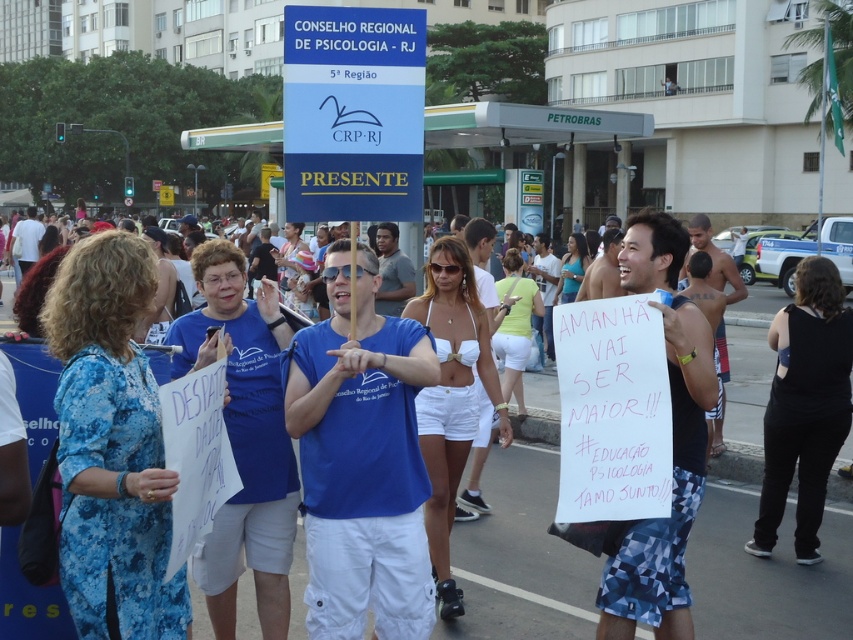
You are a journalist covering the event and need to report on the signs. Which sign, the white paper sign at center or the blue plastic sign at upper center, is bigger in size?

The white paper sign at center has a larger size compared to the blue plastic sign at upper center.

You are a photographer standing in the middle of the street. You want to take a photo that includes both the white paper sign at center and the blue plastic sign at upper center. Given their distance apart, will they both fit in your camera frame if your camera has a 6 foot field of view?

The white paper sign at center and blue plastic sign at upper center are 9.67 feet apart. Since the camera has a 6 foot field of view, which is shorter than the distance between them, they won